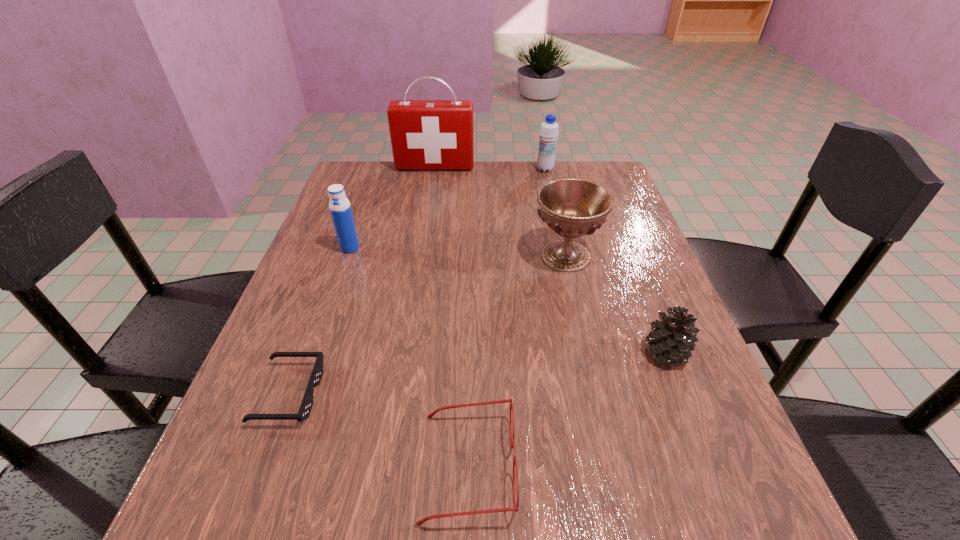
Locate an element on the screen. The height and width of the screenshot is (540, 960). the tallest object is located at coordinates (425, 134).

Where is `the right water bottle`? the right water bottle is located at coordinates (549, 130).

The image size is (960, 540). I want to click on the left water bottle, so click(x=340, y=208).

The height and width of the screenshot is (540, 960). What are the coordinates of `chalice` in the screenshot? It's located at (572, 208).

This screenshot has width=960, height=540. Find the location of `pinecone`. pinecone is located at coordinates (672, 339).

Image resolution: width=960 pixels, height=540 pixels. Identify the location of the third shortest object. (672, 339).

Locate an element on the screen. This screenshot has width=960, height=540. spectacles is located at coordinates (431, 415).

In order to click on sunglasses in this screenshot , I will do `click(304, 411)`.

At what (x,y) coordinates should I click in order to perform the action: click on blank space located on the front face of the first-aid kit. Please return your answer as a coordinate pair (x, y). The width and height of the screenshot is (960, 540). Looking at the image, I should click on (424, 235).

I want to click on vacant point located on the left of the right water bottle, so click(x=484, y=170).